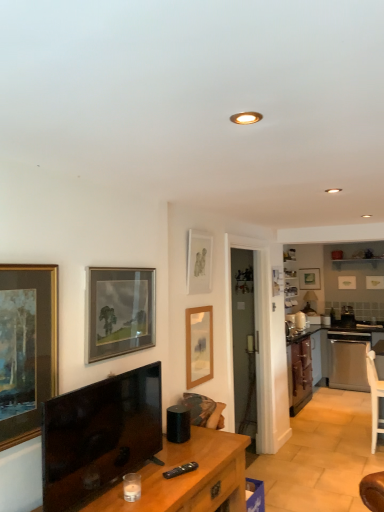
Locate an element on the screen. This screenshot has width=384, height=512. blank area beneath black glossy television at lower left (from a real-world perspective) is located at coordinates (108, 494).